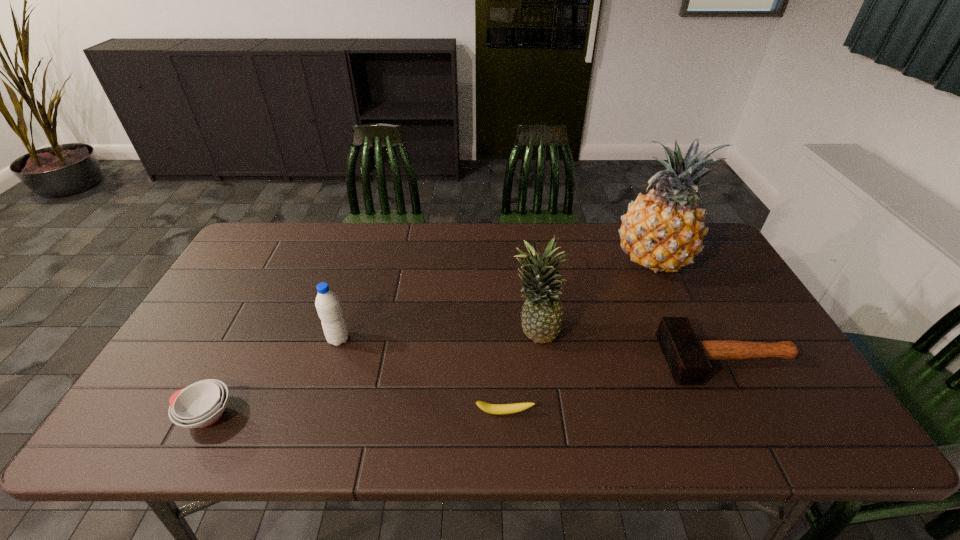
This screenshot has height=540, width=960. What are the coordinates of `the farthest object` in the screenshot? It's located at (663, 231).

Where is `the farther pineapple`? The width and height of the screenshot is (960, 540). the farther pineapple is located at coordinates (663, 231).

Where is `the left pineapple`? This screenshot has height=540, width=960. the left pineapple is located at coordinates (542, 314).

Locate an element on the screen. The image size is (960, 540). the shorter pineapple is located at coordinates [542, 314].

You are a GUI agent. You are given a task and a screenshot of the screen. Output one action in this format:
    pyautogui.click(x=<x>, y=<y>)
    Task: Click on the third tallest object
    Image resolution: width=960 pixels, height=540 pixels.
    Given the screenshot: What is the action you would take?
    pyautogui.click(x=327, y=303)

The height and width of the screenshot is (540, 960). What are the coordinates of `the second object from left to right` in the screenshot? It's located at (327, 303).

At what (x,y) coordinates should I click in order to perform the action: click on the third shortest object. Please return your answer as a coordinate pair (x, y). Image resolution: width=960 pixels, height=540 pixels. Looking at the image, I should click on (687, 357).

You are a GUI agent. You are given a task and a screenshot of the screen. Output one action in this format:
    pyautogui.click(x=<x>, y=<y>)
    Task: Click on the second shortest object
    
    Given the screenshot: What is the action you would take?
    pyautogui.click(x=201, y=404)

I want to click on the leftmost object, so click(x=201, y=404).

The height and width of the screenshot is (540, 960). I want to click on the shortest object, so click(x=498, y=409).